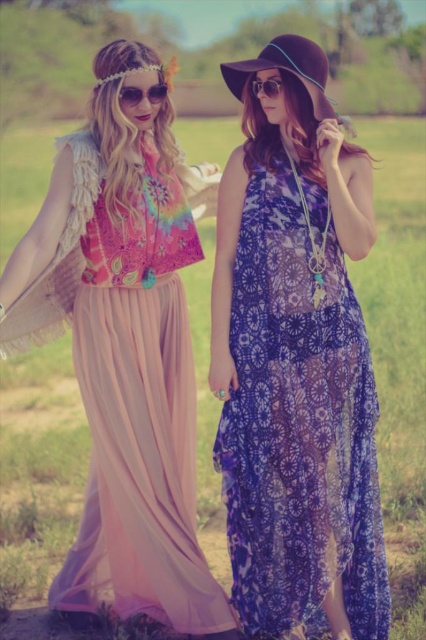
You are standing in a grassy field and want to place a small flag exactly halfway between point [367,474] and point [135,97]. Will the flag be closer to the ground or the sky in the image?

The flag placed halfway between point [367,474] and point [135,97] will be closer to the ground because point [367,474] is closer to the camera than point [135,97], so the midpoint would be closer to the lower point in the image.

You are a photographer setting up a shoot in a grassy field. You notice the purple sheer dress at right and the sunglasses at center. From the photographer perspective, which object is positioned more to the right?

The purple sheer dress at right is positioned to the right of the sunglasses at center, so the purple sheer dress at right is more to the right.